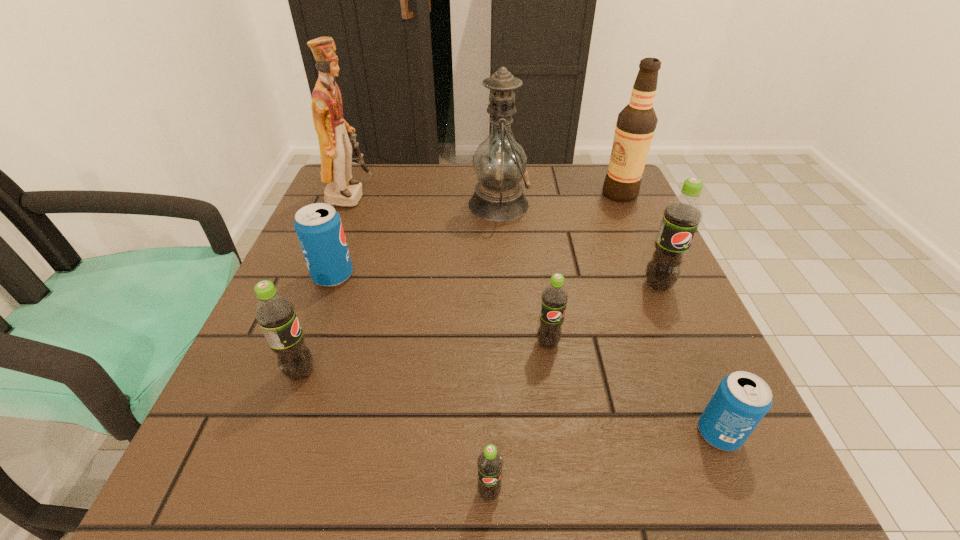
I want to click on nutcracker, so click(334, 134).

The width and height of the screenshot is (960, 540). Identify the location of oil lamp. (499, 162).

Where is `beige alcohol`? This screenshot has height=540, width=960. beige alcohol is located at coordinates (636, 123).

You are a GUI agent. You are given a task and a screenshot of the screen. Output one action in this format:
    pyautogui.click(x=<x>, y=<y>)
    Task: Click on the farthest green soda
    Image resolution: width=960 pixels, height=540 pixels.
    Given the screenshot: What is the action you would take?
    pyautogui.click(x=682, y=215)

Where is `the biggest green soda`? The height and width of the screenshot is (540, 960). the biggest green soda is located at coordinates (682, 215).

Identify the location of the leftmost green soda. This screenshot has height=540, width=960. (275, 314).

What are the coordinates of `the fifth shortest soda` in the screenshot? It's located at click(x=275, y=314).

At what (x,y) coordinates should I click in order to perform the action: click on the third green soda from left to right. Please return your answer as a coordinate pair (x, y). The image size is (960, 540). Looking at the image, I should click on (554, 297).

At what (x,y) coordinates should I click in order to perform the action: click on the second smallest green soda. Please return your answer as a coordinate pair (x, y). This screenshot has height=540, width=960. Looking at the image, I should click on (554, 297).

Locate an element on the screen. This screenshot has height=540, width=960. the farther blue soda can is located at coordinates (318, 226).